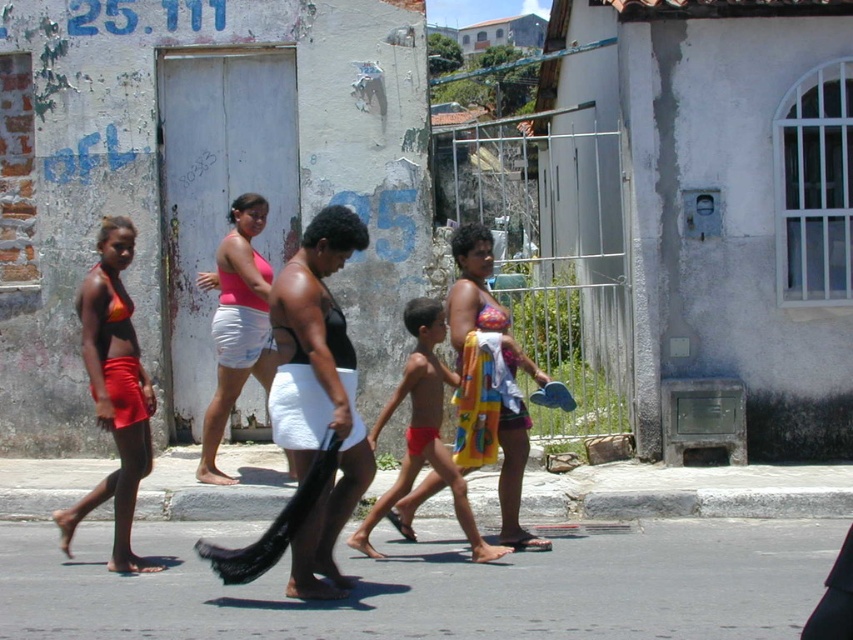
Question: Which object is positioned farthest from the black matte bikini top at center?

Choices:
 (A) red fabric towel at center
 (B) pink fabric top at center

Answer: (B)

Question: Which of the following is the farthest from the observer?

Choices:
 (A) matte orange bikini top at left
 (B) pink fabric top at center

Answer: (B)

Question: Observing the image, what is the correct spatial positioning of matte orange bikini top at left in reference to red fabric towel at center?

Choices:
 (A) right
 (B) left

Answer: (B)

Question: Which of the following is the closest to the observer?

Choices:
 (A) (415, 456)
 (B) (341, 252)
 (C) (132, 426)
 (D) (216, 385)

Answer: (B)

Question: Considering the relative positions of black matte bikini top at center and red fabric towel at center in the image provided, where is black matte bikini top at center located with respect to red fabric towel at center?

Choices:
 (A) above
 (B) below

Answer: (A)

Question: Does pink fabric top at center appear on the left side of red fabric towel at center?

Choices:
 (A) yes
 (B) no

Answer: (A)